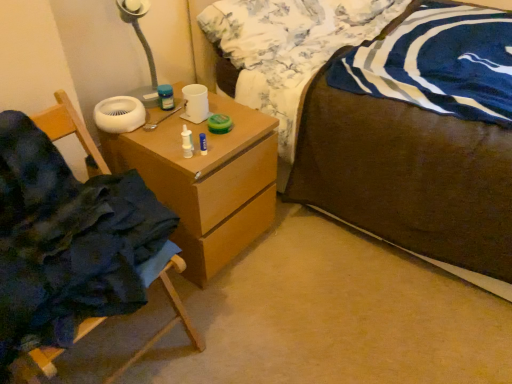
Question: From the image's perspective, is fluffy white pillow at upper center positioned above or below brown wooden bed at center?

Choices:
 (A) below
 (B) above

Answer: (B)

Question: Considering the positions of point [297, 9] and point [286, 135], is point [297, 9] closer or farther from the camera than point [286, 135]?

Choices:
 (A) closer
 (B) farther

Answer: (B)

Question: Estimate the real-world distances between objects in this image. Which object is closer to the fluffy white pillow at upper center?

Choices:
 (A) wooden chest of drawers at center
 (B) wooden chair at left
 (C) brown wooden bed at center

Answer: (C)

Question: Estimate the real-world distances between objects in this image. Which object is closer to the wooden chair at left?

Choices:
 (A) wooden chest of drawers at center
 (B) fluffy white pillow at upper center
 (C) brown wooden bed at center

Answer: (A)